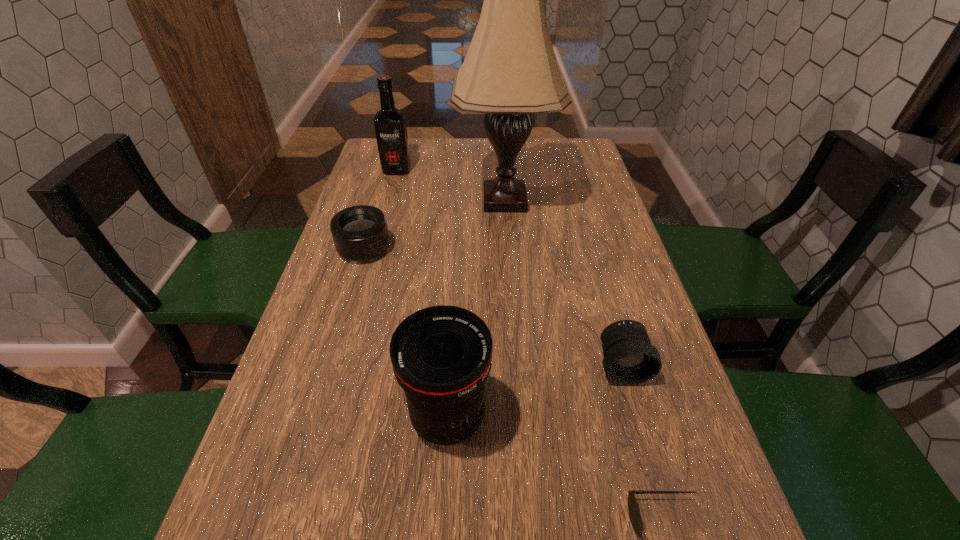
The width and height of the screenshot is (960, 540). Identify the location of vacant area at the far right corner of the desktop. point(589,171).

This screenshot has height=540, width=960. Identify the location of empty location between the farthest telephoto lens and the lamp. (435, 225).

The height and width of the screenshot is (540, 960). In order to click on blank region between the lamp and the liquor in this screenshot , I will do `click(451, 185)`.

The image size is (960, 540). I want to click on empty space between the tallest object and the shortest telephoto lens, so click(435, 225).

This screenshot has width=960, height=540. In order to click on free space between the farthest telephoto lens and the rightmost telephoto lens in this screenshot , I will do `click(493, 307)`.

The image size is (960, 540). I want to click on vacant space that's between the tallest object and the fifth shortest object, so click(x=451, y=185).

At what (x,y) coordinates should I click in order to perform the action: click on vacant area that lies between the tallest telephoto lens and the rightmost telephoto lens. Please return your answer as a coordinate pair (x, y). This screenshot has width=960, height=540. Looking at the image, I should click on (535, 392).

Locate an element on the screen. This screenshot has height=540, width=960. free area in between the rightmost telephoto lens and the farthest telephoto lens is located at coordinates (493, 307).

The height and width of the screenshot is (540, 960). Find the location of `vacant region between the rightmost telephoto lens and the lamp`. vacant region between the rightmost telephoto lens and the lamp is located at coordinates (564, 283).

Select which object appears as the closest to the sunglasses. Please provide its 2D coordinates. Your answer should be formatted as a tuple, i.e. [(x, y)], where the tuple contains the x and y coordinates of a point satisfying the conditions above.

[(629, 358)]